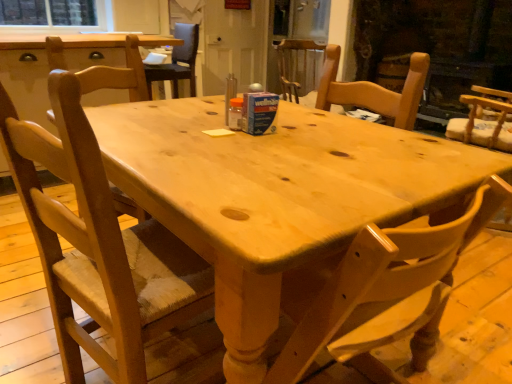
Question: From their relative heights in the image, would you say clear glass window screen at upper left is taller or shorter than wooden chair at center, placed as the second chair when sorted from back to front?

Choices:
 (A) short
 (B) tall

Answer: (A)

Question: Considering the positions of point (73, 3) and point (168, 74), is point (73, 3) closer or farther from the camera than point (168, 74)?

Choices:
 (A) farther
 (B) closer

Answer: (A)

Question: Which object is the farthest from the light wood chair at center, which is the second chair from right to left?

Choices:
 (A) natural wood chair at left, the 2th chair in the left-to-right sequence
 (B) white glossy door at upper center, positioned as the second screen door in right-to-left order
 (C) clear glass window screen at upper left
 (D) transparent glass screen door at upper center, which ranks as the 1th screen door in right-to-left order
 (E) natural wood chair at center, acting as the third chair starting from the left

Answer: (E)

Question: Estimate the real-world distances between objects in this image. Which object is farther from the light wood chair at center, acting as the 4th chair starting from the left?

Choices:
 (A) transparent glass screen door at upper center, which is the second screen door in left-to-right order
 (B) dark brick fireplace at right
 (C) wooden chair at center, which appears as the fourth chair when viewed from the front
 (D) natural wood chair at left, the 2th chair in the left-to-right sequence
 (E) clear glass window screen at upper left

Answer: (D)